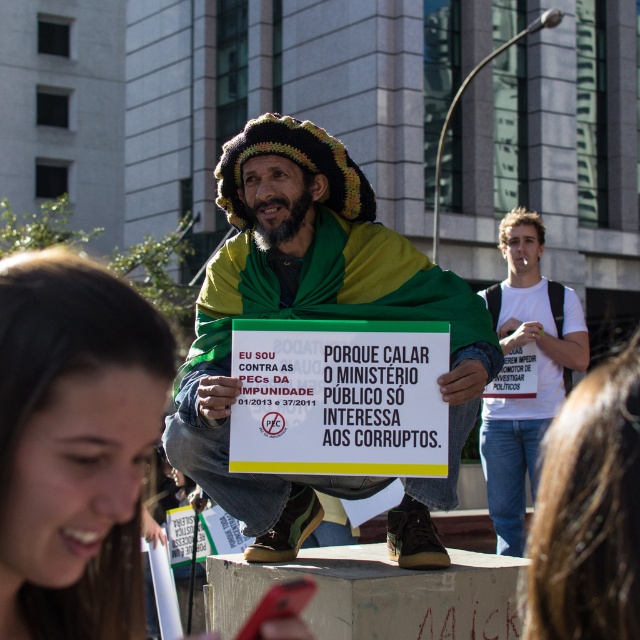
Describe the element at coordinates (314, 317) in the screenshot. I see `green/yellow fabric draped at center` at that location.

Can you confirm if green/yellow fabric draped at center is positioned below white t-shirt at center?

No, green/yellow fabric draped at center is not below white t-shirt at center.

Which is behind, point (476, 307) or point (566, 403)?

Positioned behind is point (566, 403).

Where is `green/yellow fabric draped at center`? The image size is (640, 640). green/yellow fabric draped at center is located at coordinates (314, 317).

The width and height of the screenshot is (640, 640). What do you see at coordinates (589, 512) in the screenshot? I see `white t-shirt at center` at bounding box center [589, 512].

Is white t-shirt at center above white cotton t-shirt at upper right?

No.

Is point (618, 356) less distant than point (502, 424)?

No, it is not.

At what (x,y) coordinates should I click in order to perform the action: click on white t-shirt at center. Please return your answer as a coordinate pair (x, y). This screenshot has width=640, height=640. Looking at the image, I should click on (589, 512).

Between brown hair at lower left and white t-shirt at center, which one is positioned higher?

brown hair at lower left is higher up.

This screenshot has height=640, width=640. Identify the location of brown hair at lower left. (74, 444).